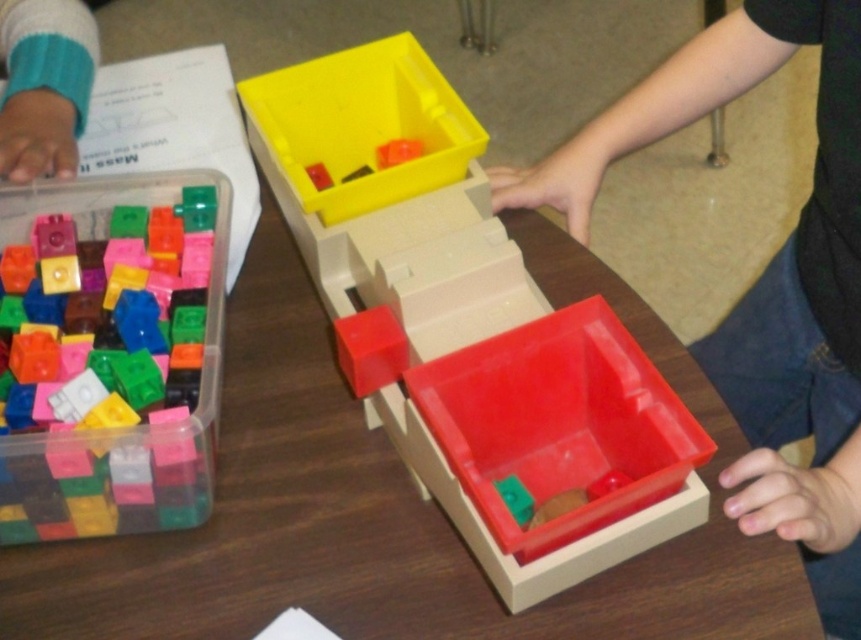
Consider the image. You are a student trying to place a block on the red plastic trough at the bottom of the inclined plane. However, there is a point marked at coordinates (555, 448). Can you tell me if this point is on the red plastic trough at the bottom of the inclined plane or somewhere else?

The point (555, 448) is on the red plastic box at center, so it is not on the red plastic trough at the bottom of the inclined plane.